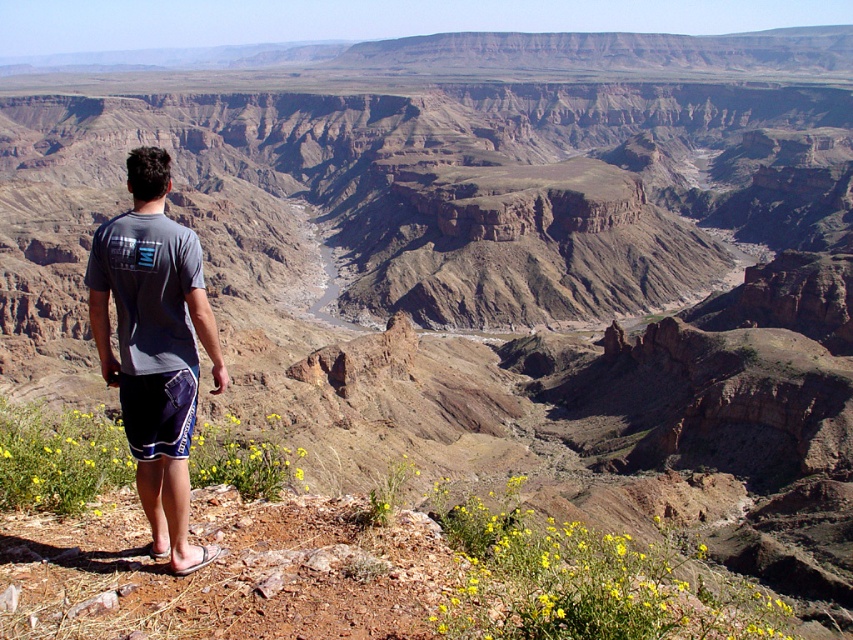
You are a geologist examining the canyon and notice a yellow matte wildflower at lower left. What is the exact coordinate of this wildflower in the image?

The yellow matte wildflower at lower left is located at point (335, 563).